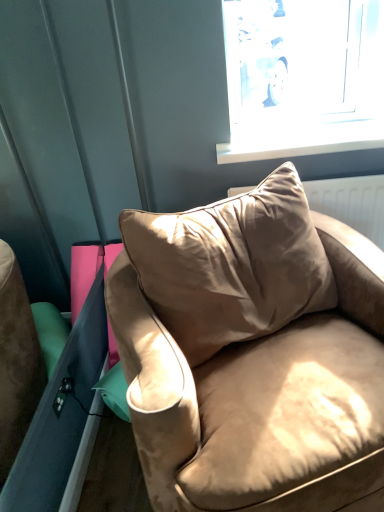
Question: Should I look upward or downward to see suede beige couch at center?

Choices:
 (A) down
 (B) up

Answer: (A)